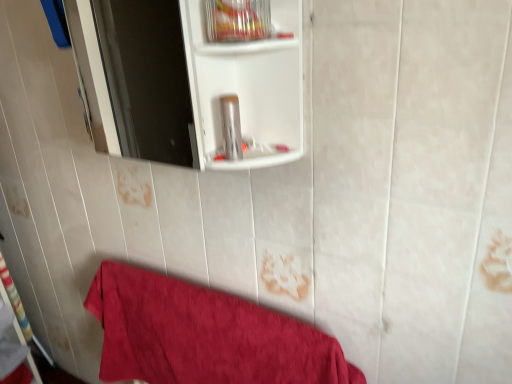
Question: Choose the correct answer: Is clear plastic container at upper center inside red cotton towel at lower left or outside it?

Choices:
 (A) outside
 (B) inside

Answer: (A)

Question: Considering the positions of clear plastic container at upper center and red cotton towel at lower left in the image, is clear plastic container at upper center wider or thinner than red cotton towel at lower left?

Choices:
 (A) thin
 (B) wide

Answer: (A)

Question: Estimate the real-world distances between objects in this image. Which object is closer to the red cotton towel at lower left?

Choices:
 (A) clear plastic container at upper center
 (B) silver metallic canister at center

Answer: (B)

Question: Which of these objects is positioned farthest from the silver metallic canister at center?

Choices:
 (A) red cotton towel at lower left
 (B) clear plastic container at upper center

Answer: (A)